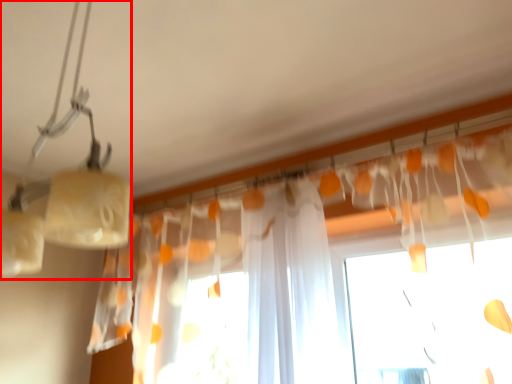
Question: Considering the relative positions of lamp (annotated by the red box) and curtain in the image provided, where is lamp (annotated by the red box) located with respect to the staircase?

Choices:
 (A) right
 (B) left

Answer: (B)